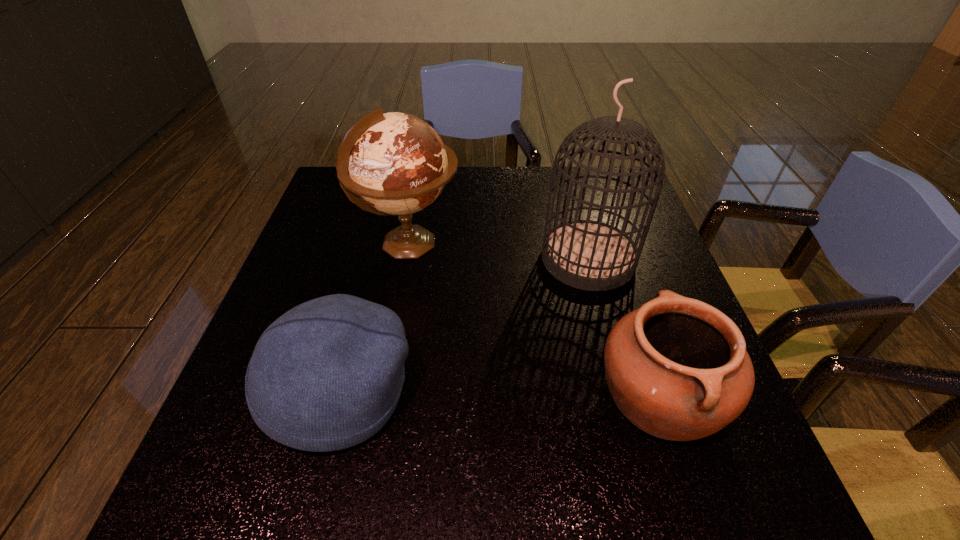
The width and height of the screenshot is (960, 540). I want to click on globe located at the left edge, so click(x=395, y=163).

What are the coordinates of `skullcap located at the left edge` in the screenshot? It's located at (327, 375).

What are the coordinates of `birdcage that is at the right edge` in the screenshot? It's located at (589, 255).

This screenshot has width=960, height=540. Find the location of `pottery situated at the right edge`. pottery situated at the right edge is located at coordinates (677, 368).

Find the location of a particular element. object positioned at the near left corner is located at coordinates (327, 375).

Find the location of a particular element. The width and height of the screenshot is (960, 540). object that is positioned at the near right corner is located at coordinates (677, 368).

Find the location of a particular element. This screenshot has height=540, width=960. vacant region at the far edge is located at coordinates (495, 198).

Find the location of a particular element. Image resolution: width=960 pixels, height=540 pixels. vacant area at the near edge of the desktop is located at coordinates (547, 473).

I want to click on vacant area at the left edge of the desktop, so click(332, 215).

Locate an element on the screen. This screenshot has height=540, width=960. vacant space at the far left corner of the desktop is located at coordinates (335, 178).